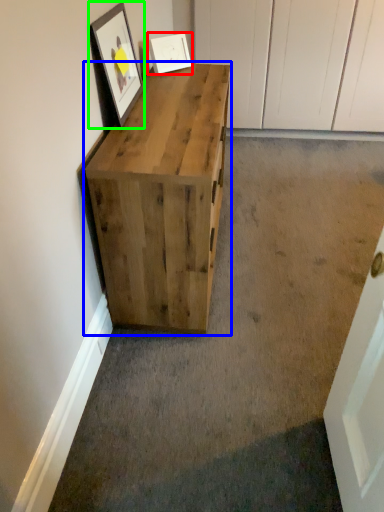
Question: Estimate the real-world distances between objects in this image. Which object is farther from picture frame (highlighted by a red box), chest of drawers (highlighted by a blue box) or picture frame (highlighted by a green box)?

Choices:
 (A) chest of drawers
 (B) picture frame

Answer: (A)